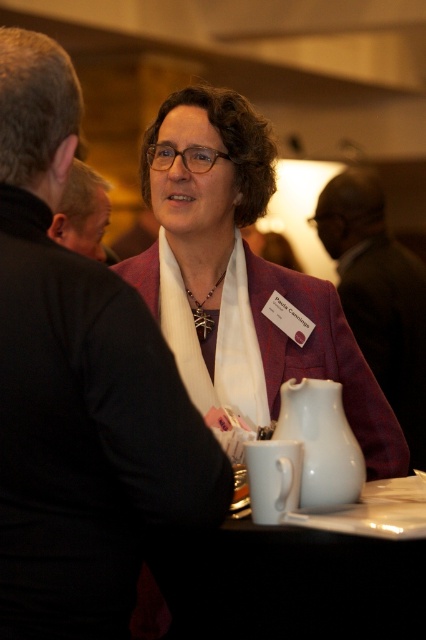
You are a waiter carrying a tray of drinks. You need to place them on the white ceramic table at lower center, which is 26.78 inches away from the matte purple jacket at center. Can you reach the table from your current position without moving your feet?

The distance between the matte purple jacket at center and the white ceramic table at lower center is 26.78 inches. Since the table is within arm reach, you can place the drinks there without moving your feet.

You are organizing a small event and need to place a 12 cm tall decorative statue between the matte purple jacket at center and the white glossy teapot at lower center. Considering their heights, which object will the statue be placed closer to?

The statue should be placed closer to the white glossy teapot at lower center because the matte purple jacket at center is taller, so the statue will be positioned nearer to the shorter object to maintain balance.

You are at a networking event and need to place a 15cm wide coffee mug on the table. The white ceramic table at lower center and the white glossy teapot at lower center are both on the table. Can the coffee mug fit on the table without overlapping the teapot?

The white ceramic table at lower center has a larger size compared to the white glossy teapot at lower center. Since the table is larger, there should be enough space to place the 15cm wide coffee mug without overlapping the teapot.